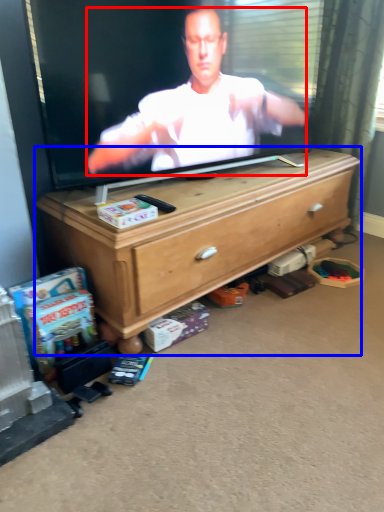
Question: Which of the following is the farthest to the observer, person (highlighted by a red box) or chest of drawers (highlighted by a blue box)?

Choices:
 (A) person
 (B) chest of drawers

Answer: (B)